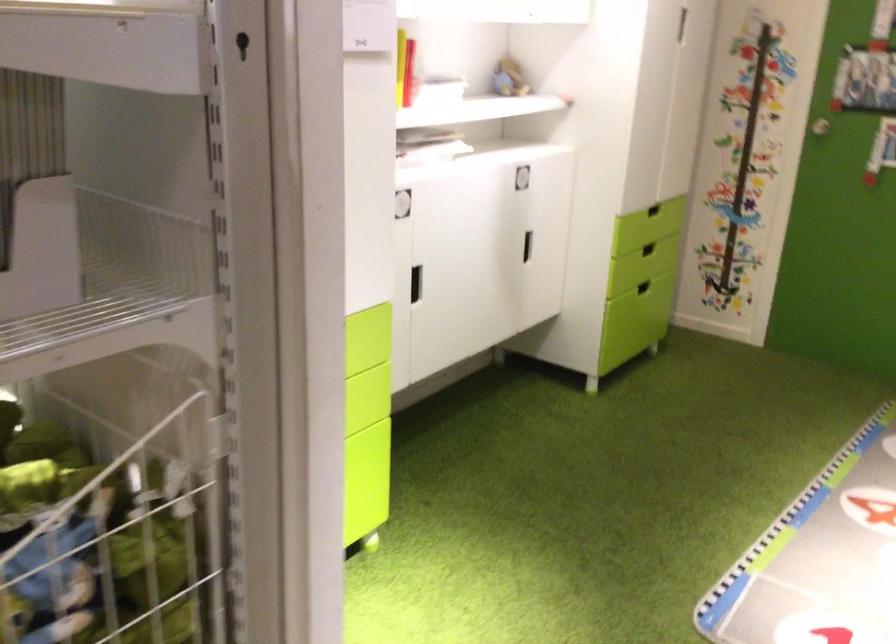
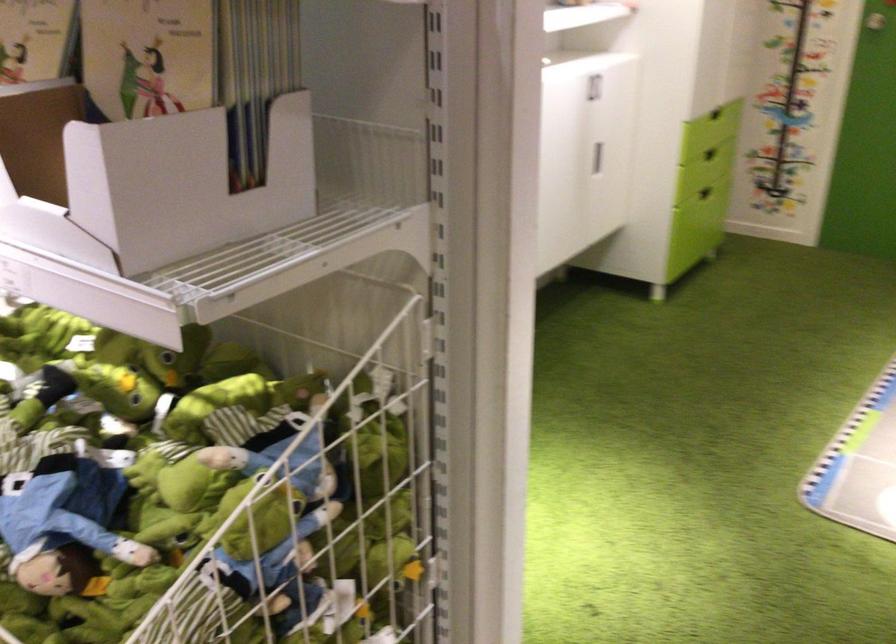
The point at (521,180) is marked in the first image. Where is the corresponding point in the second image?

(593, 87)